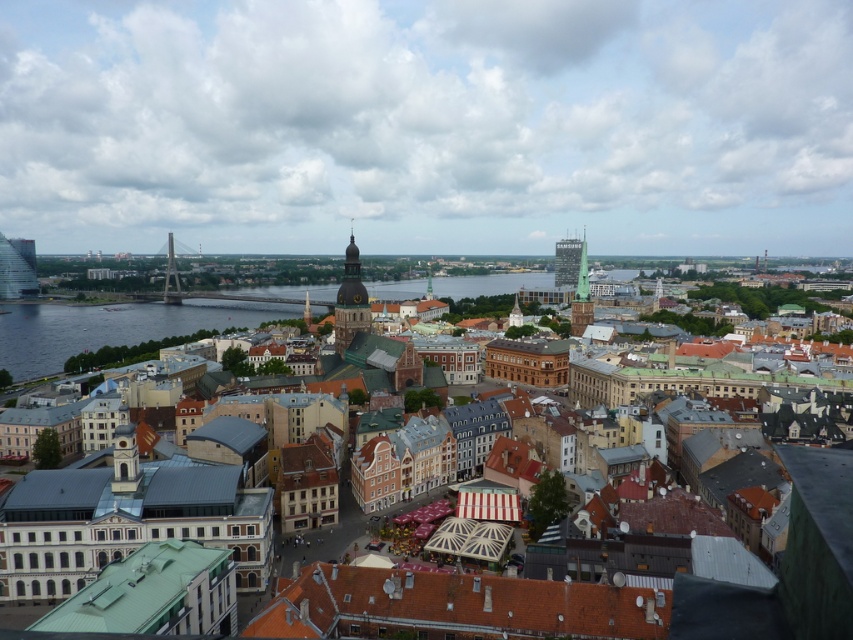
Is point (809, 592) farther from viewer compared to point (352, 237)?

No, (809, 592) is in front of (352, 237).

Is brown stone buildings at center behind green copper tower at center?

No, brown stone buildings at center is in front of green copper tower at center.

Which is behind, point (756, 602) or point (344, 276)?

The point (344, 276) is behind.

Image resolution: width=853 pixels, height=640 pixels. Identify the location of brown stone buildings at center. (786, 564).

Is brown stone buildings at center closer to the viewer compared to matte glass skyscraper at center-right?

Yes, it is in front of matte glass skyscraper at center-right.

Between brown stone buildings at center and matte glass skyscraper at center-right, which one appears on the right side from the viewer's perspective?

From the viewer's perspective, matte glass skyscraper at center-right appears more on the right side.

Between point (699, 580) and point (576, 260), which one is positioned behind?

The point (576, 260) is behind.

Where is `brown stone buildings at center`? The height and width of the screenshot is (640, 853). brown stone buildings at center is located at coordinates coord(786,564).

Does green copper tower at center appear on the left side of matte glass skyscraper at center-right?

Correct, you'll find green copper tower at center to the left of matte glass skyscraper at center-right.

Locate an element on the screen. This screenshot has width=853, height=640. green copper tower at center is located at coordinates (350, 301).